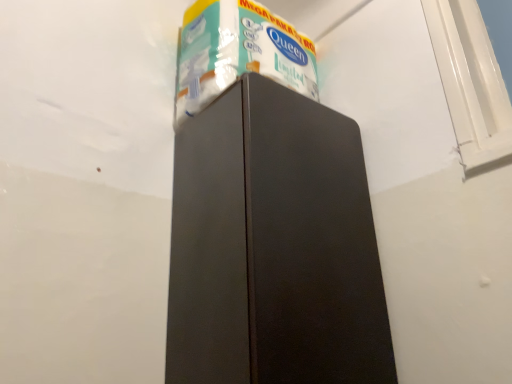
Question: From a real-world perspective, is white glossy toilet paper at upper center on top of matte black refrigerator at center?

Choices:
 (A) yes
 (B) no

Answer: (A)

Question: Is white glossy toilet paper at upper center positioned in front of matte black refrigerator at center?

Choices:
 (A) yes
 (B) no

Answer: (B)

Question: Is white glossy toilet paper at upper center aimed at matte black refrigerator at center?

Choices:
 (A) yes
 (B) no

Answer: (B)

Question: From the image's perspective, is white glossy toilet paper at upper center below matte black refrigerator at center?

Choices:
 (A) no
 (B) yes

Answer: (A)

Question: Can you confirm if white glossy toilet paper at upper center is wider than matte black refrigerator at center?

Choices:
 (A) no
 (B) yes

Answer: (A)

Question: Considering the relative positions of white glossy toilet paper at upper center and matte black refrigerator at center in the image provided, is white glossy toilet paper at upper center behind matte black refrigerator at center?

Choices:
 (A) no
 (B) yes

Answer: (B)

Question: From a real-world perspective, is matte black refrigerator at center on top of white glossy toilet paper at upper center?

Choices:
 (A) yes
 (B) no

Answer: (B)

Question: From a real-world perspective, is matte black refrigerator at center physically below white glossy toilet paper at upper center?

Choices:
 (A) yes
 (B) no

Answer: (A)

Question: From the image's perspective, does matte black refrigerator at center appear lower than white glossy toilet paper at upper center?

Choices:
 (A) no
 (B) yes

Answer: (B)

Question: Can you confirm if matte black refrigerator at center is wider than white glossy toilet paper at upper center?

Choices:
 (A) yes
 (B) no

Answer: (A)

Question: From the image's perspective, is matte black refrigerator at center on top of white glossy toilet paper at upper center?

Choices:
 (A) no
 (B) yes

Answer: (A)

Question: Is matte black refrigerator at center next to white glossy toilet paper at upper center?

Choices:
 (A) yes
 (B) no

Answer: (B)

Question: Is point (193, 54) positioned closer to the camera than point (172, 208)?

Choices:
 (A) closer
 (B) farther

Answer: (B)